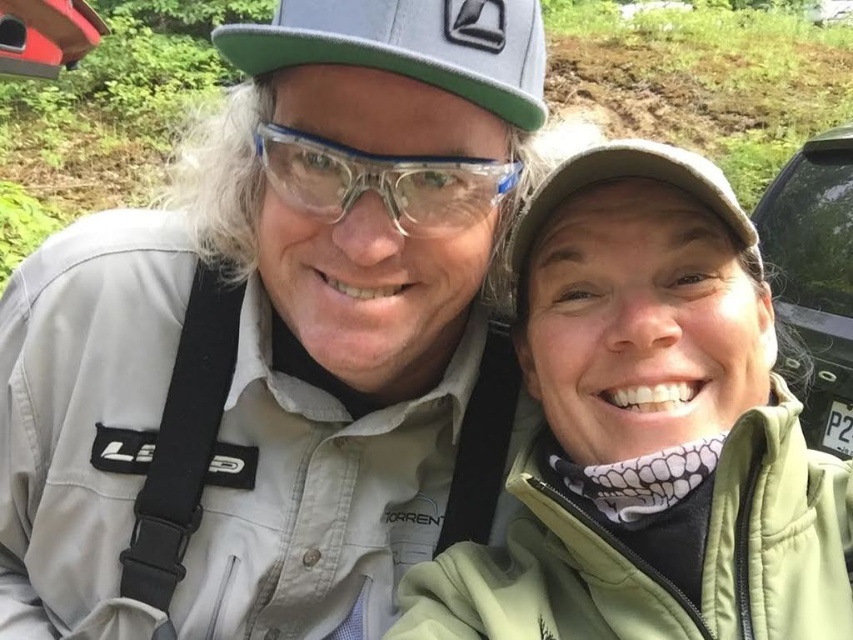
Question: Which point is closer to the camera?

Choices:
 (A) matte khaki jacket at left
 (B) green fleece jacket at upper right
 (C) gray matte baseball cap at upper center
 (D) clear plastic goggles at center

Answer: (A)

Question: Does gray matte baseball cap at upper center appear on the left side of clear plastic goggles at center?

Choices:
 (A) yes
 (B) no

Answer: (A)

Question: Which of these objects is positioned closest to the green fleece jacket at upper right?

Choices:
 (A) matte khaki jacket at left
 (B) gray matte baseball cap at upper center
 (C) clear plastic goggles at center
 (D) green matte car at right

Answer: (C)

Question: Which point appears farthest from the camera in this image?

Choices:
 (A) (848, 136)
 (B) (433, 468)
 (C) (228, 26)
 (D) (463, 180)

Answer: (A)

Question: Can you confirm if gray matte baseball cap at upper center is wider than green matte car at right?

Choices:
 (A) no
 (B) yes

Answer: (A)

Question: Does gray matte baseball cap at upper center have a lesser width compared to clear plastic goggles at center?

Choices:
 (A) no
 (B) yes

Answer: (A)